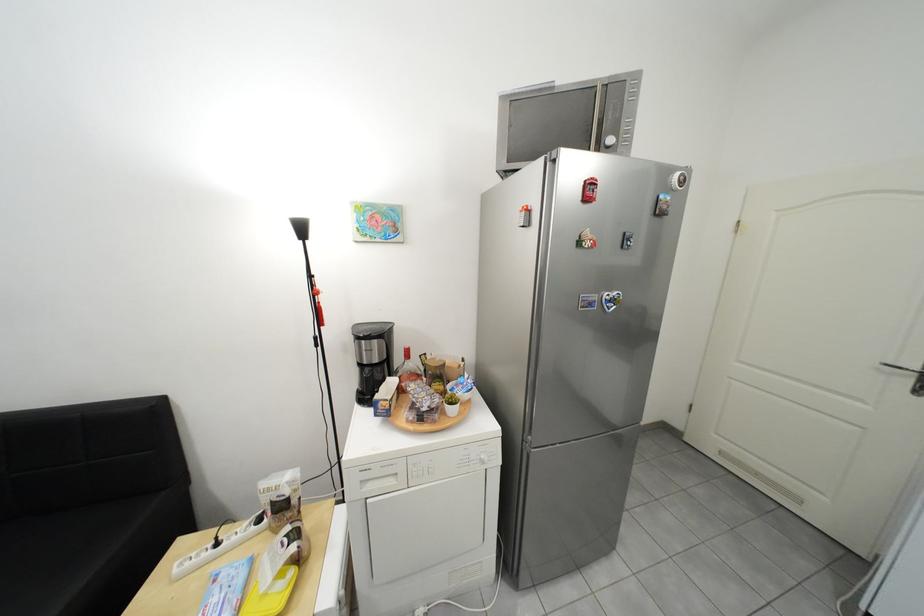
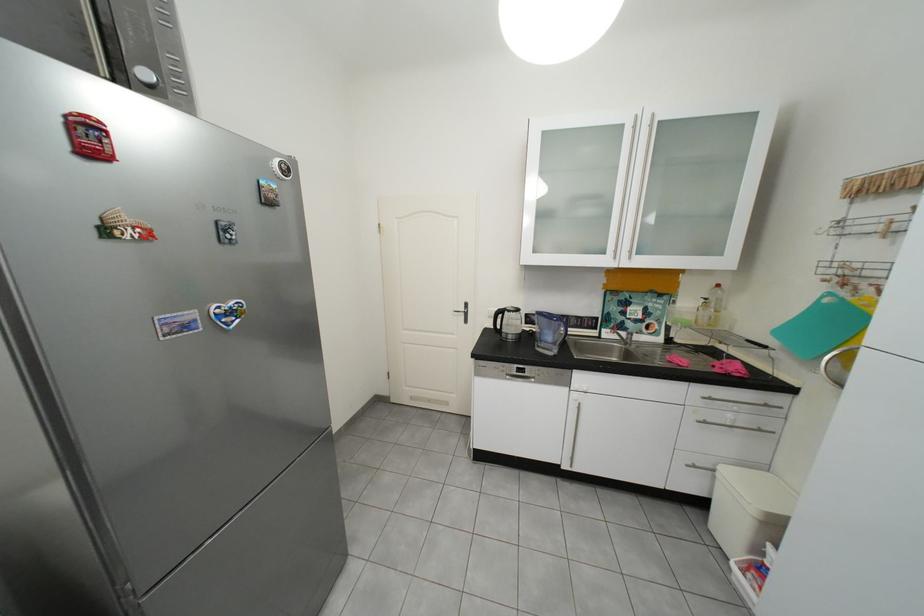
Locate, in the second image, the point that corresponds to the point at 622,142 in the first image.

(156, 75)